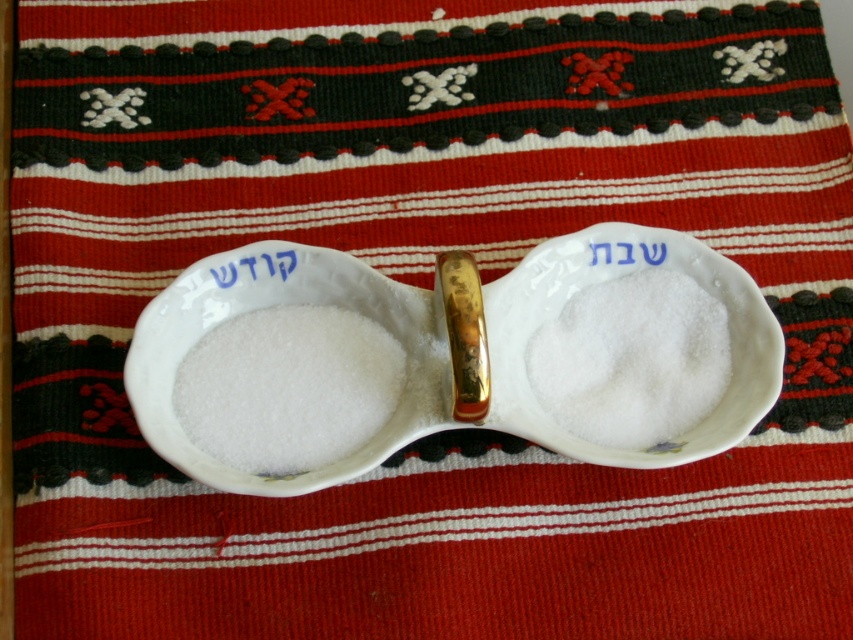
You are a baker preparing to make dough and see the white powdery flour at center and the white paper at center on the counter. Which item occupies a larger area on the counter?

The white powdery flour at center has a greater width than the white paper at center, so it occupies a larger area on the counter.

You are a chef preparing a dish that requires precise measurements. You have two items on your table, the white powder at center and the white ceramic text at center. Which item has a larger width?

The white powder at center has a larger width than the white ceramic text at center according to the description.

You are a baker preparing for a baking competition and see the white powdery flour at center and the white paper at center on the counter. Which item is closer to the edge of the counter?

The white paper at center is closer to the edge of the counter because the white powdery flour at center is located below it, meaning the flour is further back and the paper is nearer the edge.